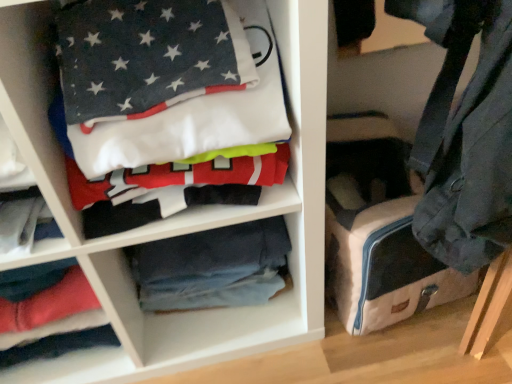
Describe the element at coordinates (170, 107) in the screenshot. I see `dark blue cotton t-shirt at upper left` at that location.

Where is `canvas suitcase at lower right`? This screenshot has width=512, height=384. canvas suitcase at lower right is located at coordinates (378, 229).

Is canvas suitcase at lower right spatially inside dark blue cotton t-shirt at upper left, or outside of it?

canvas suitcase at lower right exists outside the volume of dark blue cotton t-shirt at upper left.

Does point (377, 304) lie in front of point (71, 169)?

No, (377, 304) is further to viewer.

Image resolution: width=512 pixels, height=384 pixels. Identify the location of laundry positioned vertically above the canvas suitcase at lower right (from a real-world perspective). (170, 107).

Considering the relative positions of canvas suitcase at lower right and dark blue cotton t-shirt at upper left in the image provided, is canvas suitcase at lower right to the left or to the right of dark blue cotton t-shirt at upper left?

canvas suitcase at lower right is to the right of dark blue cotton t-shirt at upper left.

Is the position of blue denim jeans at center more distant than that of canvas suitcase at lower right?

Yes, blue denim jeans at center is behind canvas suitcase at lower right.

Does blue denim jeans at center have a lesser height compared to canvas suitcase at lower right?

Correct, blue denim jeans at center is not as tall as canvas suitcase at lower right.

From a real-world perspective, is blue denim jeans at center positioned over canvas suitcase at lower right based on gravity?

No, from a real-world perspective, blue denim jeans at center is not above canvas suitcase at lower right.

From the image's perspective, is canvas suitcase at lower right on blue denim jeans at center?

Yes, from the image's perspective, canvas suitcase at lower right is on top of blue denim jeans at center.

Considering the relative sizes of canvas suitcase at lower right and blue denim jeans at center in the image provided, is canvas suitcase at lower right smaller than blue denim jeans at center?

No, canvas suitcase at lower right is not smaller than blue denim jeans at center.

From a real-world perspective, who is located lower, canvas suitcase at lower right or blue denim jeans at center?

In real-world perspective, blue denim jeans at center is lower.

Which object is positioned more to the left, blue denim jeans at center or dark blue cotton t-shirt at upper left?

dark blue cotton t-shirt at upper left.

Is point (255, 270) behind point (199, 140)?

Yes, it is.

At what (x,y) coordinates should I click in order to perform the action: click on laundry located above the blue denim jeans at center (from a real-world perspective). Please return your answer as a coordinate pair (x, y). The image size is (512, 384). Looking at the image, I should click on (170, 107).

Is the surface of blue denim jeans at center in direct contact with dark blue cotton t-shirt at upper left?

blue denim jeans at center and dark blue cotton t-shirt at upper left are clearly separated.

Is dark blue cotton t-shirt at upper left surrounding blue denim jeans at center?

Actually, blue denim jeans at center is outside dark blue cotton t-shirt at upper left.

Is dark blue cotton t-shirt at upper left to the left of blue denim jeans at center from the viewer's perspective?

Correct, you'll find dark blue cotton t-shirt at upper left to the left of blue denim jeans at center.

What's the angular difference between dark blue cotton t-shirt at upper left and blue denim jeans at center's facing directions?

6.11e-05 degrees.

Which of these two, dark blue cotton t-shirt at upper left or blue denim jeans at center, stands taller?

dark blue cotton t-shirt at upper left.

Is canvas suitcase at lower right located within dark blue cotton t-shirt at upper left?

Definitely not — canvas suitcase at lower right is not inside dark blue cotton t-shirt at upper left.

Locate an element on the screen. pack to the right of dark blue cotton t-shirt at upper left is located at coordinates (378, 229).

From the image's perspective, is dark blue cotton t-shirt at upper left beneath canvas suitcase at lower right?

Actually, dark blue cotton t-shirt at upper left appears above canvas suitcase at lower right in the image.

Who is bigger, dark blue cotton t-shirt at upper left or canvas suitcase at lower right?

dark blue cotton t-shirt at upper left.

This screenshot has width=512, height=384. I want to click on laundry in front of the canvas suitcase at lower right, so (x=170, y=107).

Where is `material on the left of the canvas suitcase at lower right`? This screenshot has height=384, width=512. material on the left of the canvas suitcase at lower right is located at coordinates (212, 267).

When comparing their distances from dark blue cotton t-shirt at upper left, does canvas suitcase at lower right or blue denim jeans at center seem further?

The object further to dark blue cotton t-shirt at upper left is canvas suitcase at lower right.

Based on their spatial positions, is blue denim jeans at center or canvas suitcase at lower right further from dark blue cotton t-shirt at upper left?

canvas suitcase at lower right is positioned further to the anchor dark blue cotton t-shirt at upper left.

Considering their positions, is dark blue cotton t-shirt at upper left positioned further to canvas suitcase at lower right than blue denim jeans at center?

The object further to canvas suitcase at lower right is dark blue cotton t-shirt at upper left.

Looking at the image, which one is located closer to blue denim jeans at center, dark blue cotton t-shirt at upper left or canvas suitcase at lower right?

canvas suitcase at lower right lies closer to blue denim jeans at center than the other object.

When comparing their distances from canvas suitcase at lower right, does blue denim jeans at center or dark blue cotton t-shirt at upper left seem closer?

blue denim jeans at center lies closer to canvas suitcase at lower right than the other object.

When comparing their distances from blue denim jeans at center, does canvas suitcase at lower right or dark blue cotton t-shirt at upper left seem further?

Based on the image, dark blue cotton t-shirt at upper left appears to be further to blue denim jeans at center.

The height and width of the screenshot is (384, 512). I want to click on material between dark blue cotton t-shirt at upper left and canvas suitcase at lower right in the horizontal direction, so click(x=212, y=267).